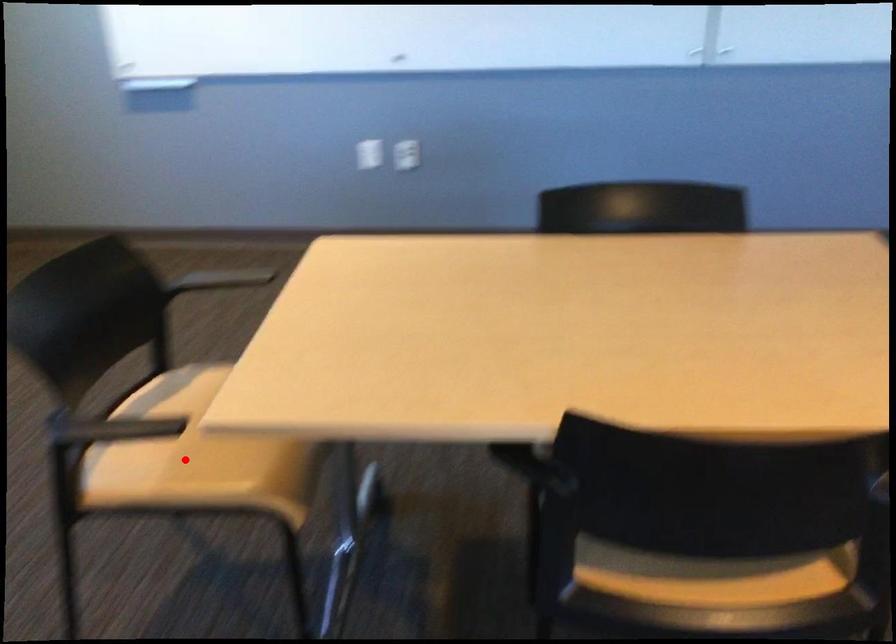
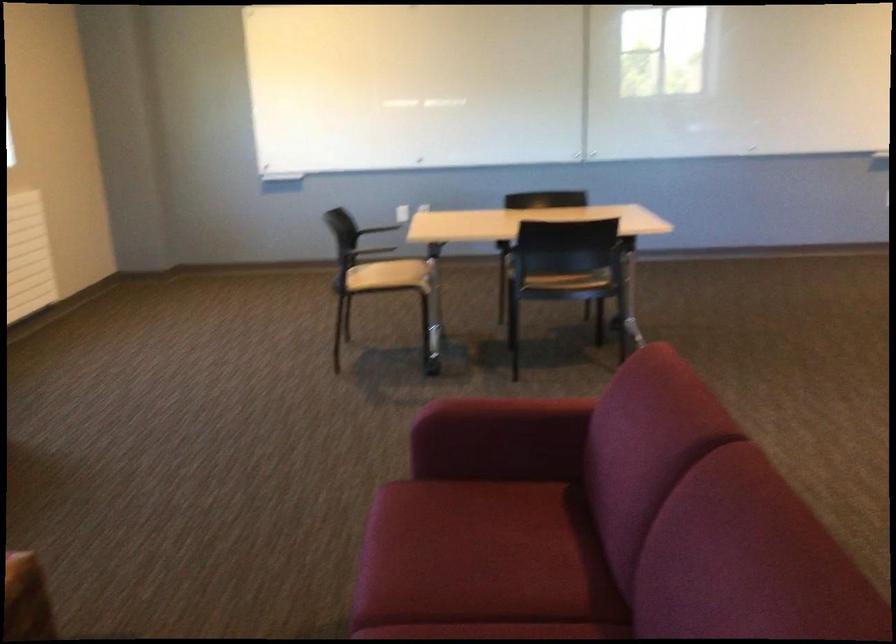
Question: I am providing you with two images of the same scene from different viewpoints. A red point is shown in image1. For the corresponding object point in image2, is it positioned nearer or farther from the camera?

Choices:
 (A) Nearer
 (B) Farther

Answer: (B)